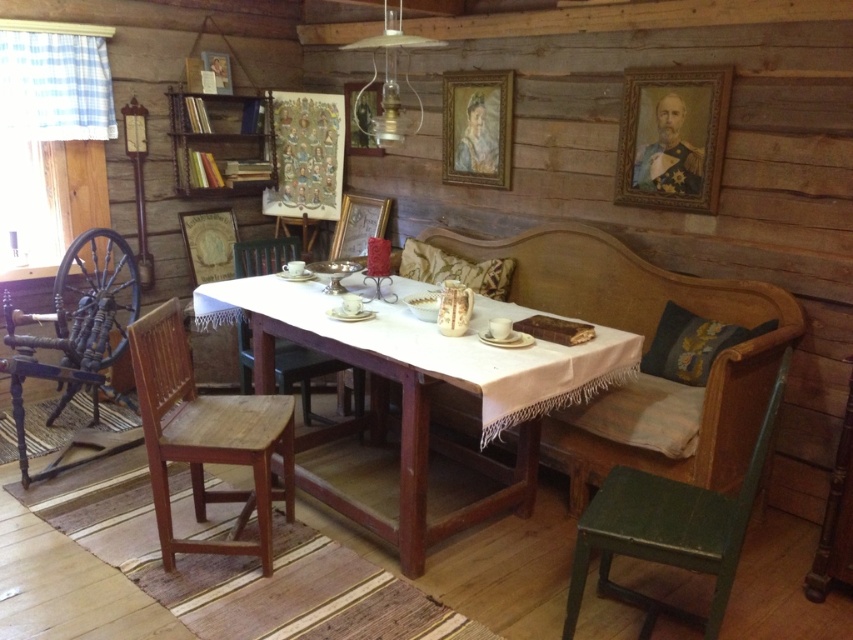
You are sitting at the wooden table in the center of the room and notice two points on the table surface. One is located at coordinate point (286, 390) and the other at point (770, 326). If you want to reach the point closer to you, which coordinate should you aim for?

Point (286, 390) is closer to you than point (770, 326), so you should aim for point (286, 390).

You are sitting in the wooden chair at lower left and want to reach the wooden spool at left. Can you easily grab it without moving your seat?

The wooden chair at lower left is located below the wooden spool at left, so you can easily reach the wooden spool at left by stretching your hand upwards since it is positioned above you.